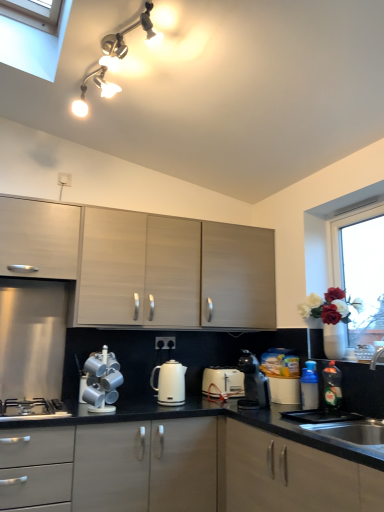
The width and height of the screenshot is (384, 512). What are the coordinates of `vacant space in front of white glossy electric kettle at center, arranged as the 2th kitchen appliance when viewed from the right` in the screenshot? It's located at (162, 411).